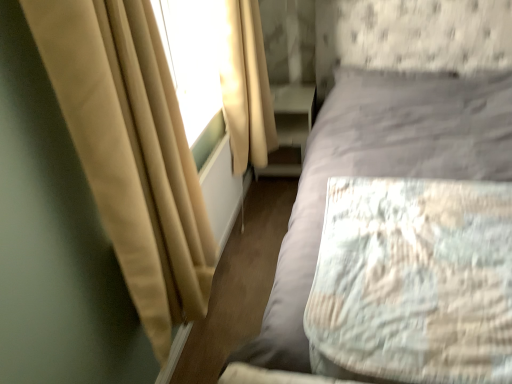
Question: Is matte white dresser at lower center far away from textured gray bed at center?

Choices:
 (A) no
 (B) yes

Answer: (A)

Question: From the image's perspective, is matte white dresser at lower center on textured gray bed at center?

Choices:
 (A) no
 (B) yes

Answer: (B)

Question: Does matte white dresser at lower center have a greater height compared to textured gray bed at center?

Choices:
 (A) no
 (B) yes

Answer: (A)

Question: Considering the relative positions of matte white dresser at lower center and textured gray bed at center in the image provided, is matte white dresser at lower center in front of textured gray bed at center?

Choices:
 (A) no
 (B) yes

Answer: (A)

Question: Is textured gray bed at center located within matte white dresser at lower center?

Choices:
 (A) no
 (B) yes

Answer: (A)

Question: Considering the relative positions of light gray fabric mattress at right and beige fabric curtain at left, which appears as the first curtain when viewed from the front, in the image provided, is light gray fabric mattress at right to the left or to the right of beige fabric curtain at left, which appears as the first curtain when viewed from the front,?

Choices:
 (A) right
 (B) left

Answer: (A)

Question: From a real-world perspective, is light gray fabric mattress at right above or below beige fabric curtain at left, placed as the 2th curtain when sorted from back to front?

Choices:
 (A) below
 (B) above

Answer: (A)

Question: Is point (322, 352) positioned closer to the camera than point (159, 289)?

Choices:
 (A) farther
 (B) closer

Answer: (B)

Question: Is light gray fabric mattress at right inside the boundaries of beige fabric curtain at left, which appears as the first curtain when viewed from the front, or outside?

Choices:
 (A) outside
 (B) inside

Answer: (A)

Question: Considering their positions, is beige fabric curtain at upper left, the 1th curtain when ordered from back to front, located in front of or behind beige fabric curtain at left, which appears as the first curtain when viewed from the front?

Choices:
 (A) behind
 (B) front

Answer: (A)

Question: In terms of width, does beige fabric curtain at upper left, arranged as the second curtain when viewed from the front, look wider or thinner when compared to beige fabric curtain at left, which appears as the first curtain when viewed from the front?

Choices:
 (A) thin
 (B) wide

Answer: (B)

Question: From the image's perspective, is beige fabric curtain at upper left, arranged as the second curtain when viewed from the front, located above or below beige fabric curtain at left, which appears as the first curtain when viewed from the front?

Choices:
 (A) above
 (B) below

Answer: (A)

Question: Looking at the image, does beige fabric curtain at upper left, the 1th curtain when ordered from back to front, seem bigger or smaller compared to beige fabric curtain at left, placed as the 2th curtain when sorted from back to front?

Choices:
 (A) big
 (B) small

Answer: (B)

Question: Does point (373, 354) appear closer or farther from the camera than point (334, 139)?

Choices:
 (A) closer
 (B) farther

Answer: (A)

Question: From the image's perspective, relative to textured gray bed at center, is light gray fabric mattress at right above or below?

Choices:
 (A) below
 (B) above

Answer: (A)